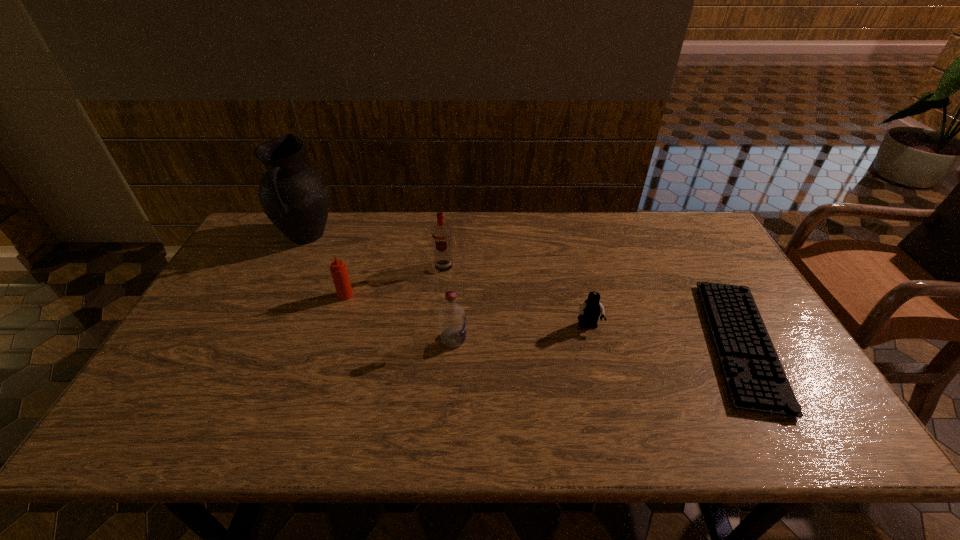
Identify the location of the farthest object. (294, 196).

Locate an element on the screen. the leftmost object is located at coordinates (294, 196).

I want to click on the second farthest object, so tap(441, 236).

Where is `the farther vodka`? The image size is (960, 540). the farther vodka is located at coordinates (441, 236).

You are a GUI agent. You are given a task and a screenshot of the screen. Output one action in this format:
    pyautogui.click(x=<x>, y=<y>)
    Task: Click on the nearer vodka
    
    Given the screenshot: What is the action you would take?
    pyautogui.click(x=452, y=321)

The height and width of the screenshot is (540, 960). Find the location of `Tabasco sauce`. Tabasco sauce is located at coordinates (338, 269).

Where is `the fifth tallest object`? the fifth tallest object is located at coordinates point(590,310).

Identify the location of Lego. This screenshot has width=960, height=540. (590, 310).

At what (x,y) coordinates should I click in order to perform the action: click on the shortest object. Please return your answer as a coordinate pair (x, y). The height and width of the screenshot is (540, 960). Looking at the image, I should click on (756, 381).

Where is `the rightmost object`? the rightmost object is located at coordinates (756, 381).